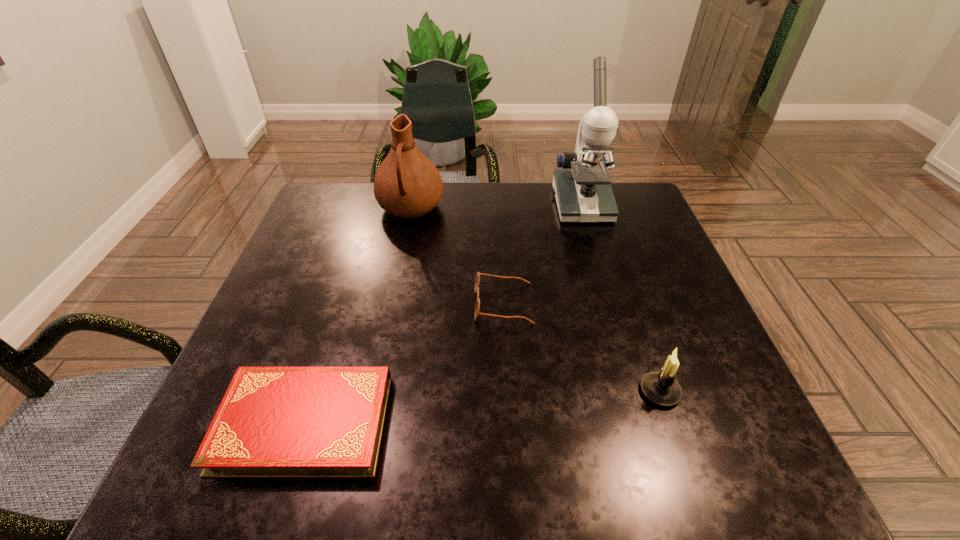
Locate an element on the screen. This screenshot has height=540, width=960. microscope is located at coordinates (583, 192).

Identify the location of the fourth shortest object. (407, 184).

The height and width of the screenshot is (540, 960). What are the coordinates of `the third tallest object` in the screenshot? It's located at (660, 387).

Image resolution: width=960 pixels, height=540 pixels. Identify the location of the third farthest object. (477, 307).

You are a GUI agent. You are given a task and a screenshot of the screen. Output one action in this format:
    pyautogui.click(x=<x>, y=<y>)
    Task: Click on the third object from right to left
    The image size is (960, 540).
    Given the screenshot: What is the action you would take?
    pyautogui.click(x=477, y=307)

The width and height of the screenshot is (960, 540). What are the coordinates of `hardback book` in the screenshot? It's located at point(273,422).

Image resolution: width=960 pixels, height=540 pixels. What are the coordinates of `vacant area situated 0.160m on the left of the tallest object` in the screenshot? It's located at (499, 204).

Where is `vacant space situated on the side of the second tallest object with the handle`? Image resolution: width=960 pixels, height=540 pixels. vacant space situated on the side of the second tallest object with the handle is located at coordinates (389, 315).

The image size is (960, 540). Find the location of `blank area located 0.200m on the left of the third shortest object`. blank area located 0.200m on the left of the third shortest object is located at coordinates (533, 391).

I want to click on vacant space located 0.070m on the front-facing side of the spectacles, so click(x=444, y=304).